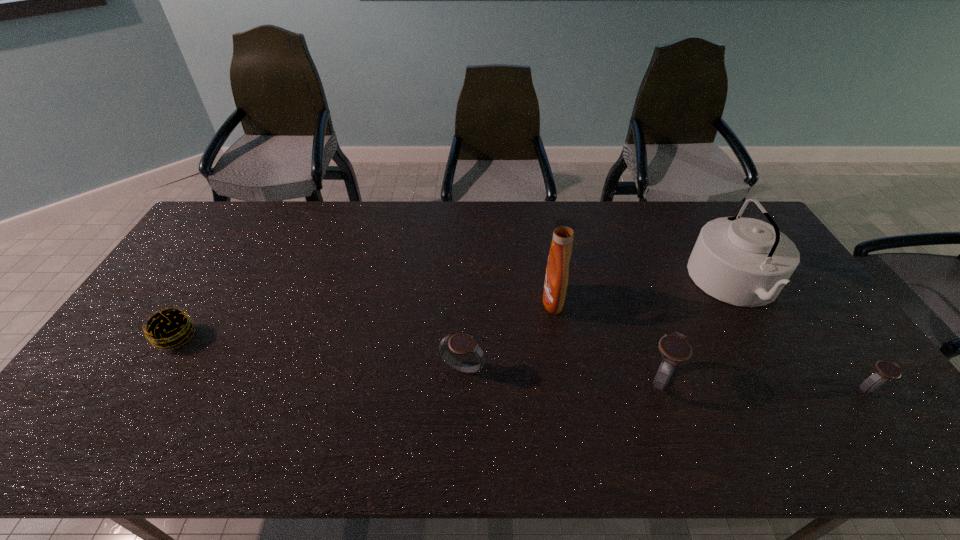
Image resolution: width=960 pixels, height=540 pixels. I want to click on blank area located on the left of the rightmost watch, so (x=721, y=389).

At what (x,y) coordinates should I click in order to perform the action: click on free spot located on the spout of the kettle. Please return your answer as a coordinate pair (x, y). This screenshot has width=960, height=540. Looking at the image, I should click on (636, 284).

I want to click on vacant space located 0.280m on the spout of the kettle, so click(603, 284).

At what (x,y) coordinates should I click in order to perform the action: click on vacant space situated 0.300m on the spout of the kettle. Please return your answer as a coordinate pair (x, y). Image resolution: width=960 pixels, height=540 pixels. Looking at the image, I should click on (597, 284).

Identify the location of vacant space situated on the front-facing side of the detergent. (519, 301).

The height and width of the screenshot is (540, 960). Identify the location of free space located 0.240m on the front-facing side of the detergent. (463, 301).

You are a GUI agent. You are given a task and a screenshot of the screen. Output one action in this format:
    pyautogui.click(x=<x>, y=<y>)
    Task: Click on the vacant space located on the front-facing side of the detergent
    This screenshot has height=540, width=960.
    Given the screenshot: What is the action you would take?
    point(457,301)

You are a GUI agent. You are given a task and a screenshot of the screen. Output one action in this format:
    pyautogui.click(x=<x>, y=<y>)
    Task: Click on the vacant space positioned on the right of the patty
    
    Given the screenshot: What is the action you would take?
    pyautogui.click(x=329, y=337)

I want to click on object present at the left edge, so click(168, 328).

This screenshot has width=960, height=540. I want to click on watch positioned at the right edge, so click(884, 370).